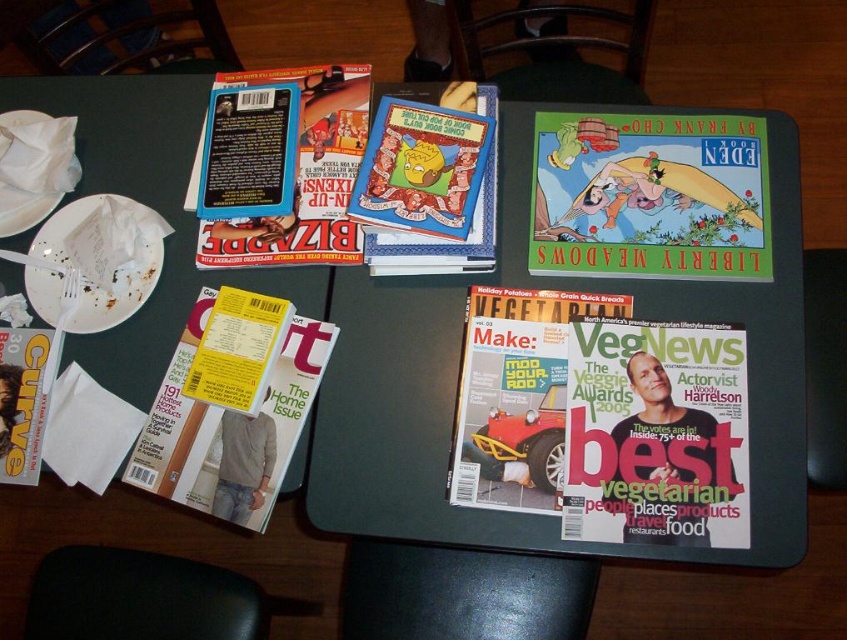
Question: Which point is farther to the camera?

Choices:
 (A) hardcover comic book at center
 (B) matte yellow magazine at lower left
 (C) cartoonish paper book at center
 (D) matte blue book at upper left

Answer: (D)

Question: Does matte black magazine at center appear on the left side of matte paper magazine at center?

Choices:
 (A) no
 (B) yes

Answer: (A)

Question: Among these points, which one is farthest from the camera?

Choices:
 (A) (591, 426)
 (B) (640, 120)
 (C) (484, 456)

Answer: (B)

Question: Does matte black magazine at center appear over cartoonish paper book at center?

Choices:
 (A) no
 (B) yes

Answer: (A)

Question: Can you confirm if hardcover comic book at center is positioned below cartoonish paper book at center?

Choices:
 (A) no
 (B) yes

Answer: (B)

Question: Which of these objects is positioned closest to the matte paper magazine at center?

Choices:
 (A) matte yellow magazine at lower left
 (B) cartoonish paper book at center

Answer: (B)